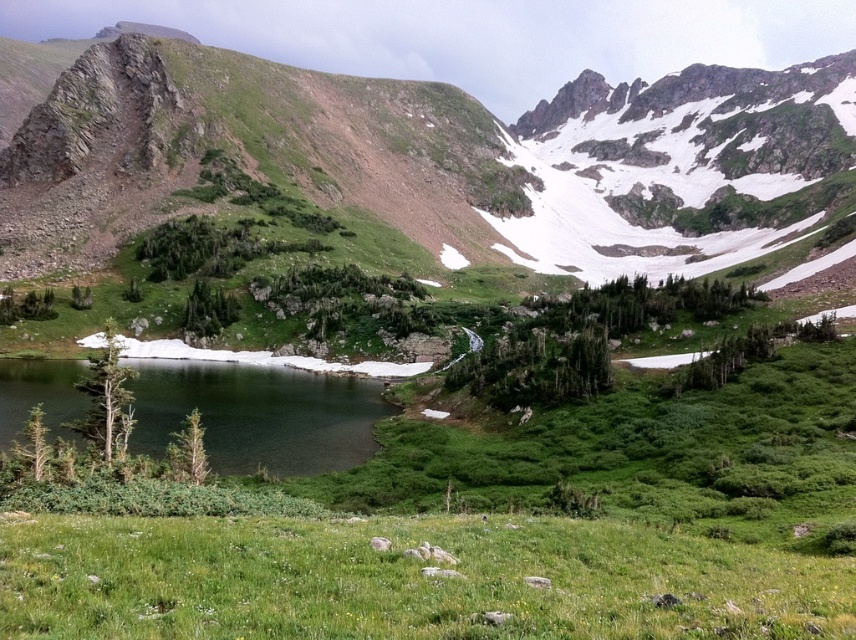
Question: Which of the following is the closest to the observer?

Choices:
 (A) (221, 449)
 (B) (718, 621)

Answer: (B)

Question: Is green grassy field at lower center thinner than green glassy water at lower left?

Choices:
 (A) yes
 (B) no

Answer: (A)

Question: Is green grassy field at lower center closer to camera compared to green glassy water at lower left?

Choices:
 (A) yes
 (B) no

Answer: (A)

Question: Is green grassy field at lower center behind green glassy water at lower left?

Choices:
 (A) yes
 (B) no

Answer: (B)